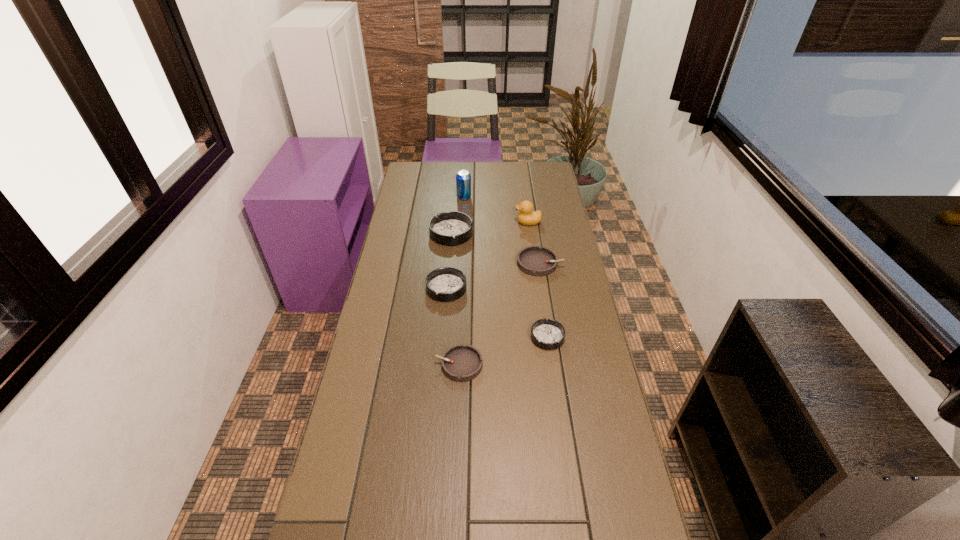
Identify the location of empty space between the farther gray ashtray and the second nearest dark ashtray. This screenshot has height=540, width=960. (493, 276).

The height and width of the screenshot is (540, 960). Find the location of `unoccupied position between the bigger gray ashtray and the second nearest dark ashtray`. unoccupied position between the bigger gray ashtray and the second nearest dark ashtray is located at coordinates (493, 276).

The image size is (960, 540). I want to click on vacant space in between the beer can and the second tallest object, so click(496, 210).

Identify the location of vacant point located between the farthest object and the second tallest object. This screenshot has height=540, width=960. (496, 210).

The width and height of the screenshot is (960, 540). Find the location of `vacant area that lies between the bigger gray ashtray and the duckling`. vacant area that lies between the bigger gray ashtray and the duckling is located at coordinates (534, 242).

The height and width of the screenshot is (540, 960). I want to click on unoccupied position between the rightmost dark ashtray and the second smallest dark ashtray, so click(x=497, y=313).

In order to click on object that is the fourth closest to the nearer gray ashtray in this screenshot , I will do `click(450, 228)`.

Identify which object is the fourth closest to the second biggest dark ashtray. Please provide its 2D coordinates. Your answer should be formatted as a tuple, i.e. [(x, y)], where the tuple contains the x and y coordinates of a point satisfying the conditions above.

[(549, 334)]

Locate which ashtray is the second closest to the farthest ashtray. Please provide its 2D coordinates. Your answer should be formatted as a tuple, i.e. [(x, y)], where the tuple contains the x and y coordinates of a point satisfying the conditions above.

[(533, 260)]

Where is `ashtray that is the closest to the tallest object`? The height and width of the screenshot is (540, 960). ashtray that is the closest to the tallest object is located at coordinates (450, 228).